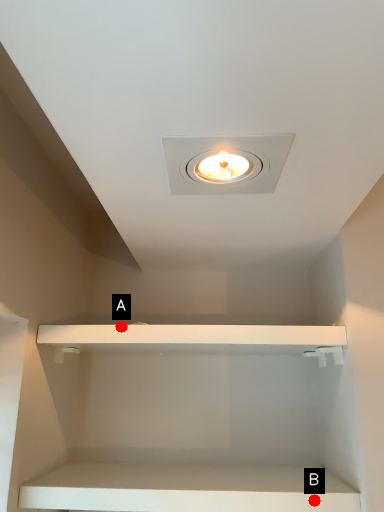
Question: Two points are circled on the image, labeled by A and B beside each circle. Among these points, which one is nearest to the camera?

Choices:
 (A) A is closer
 (B) B is closer

Answer: (B)